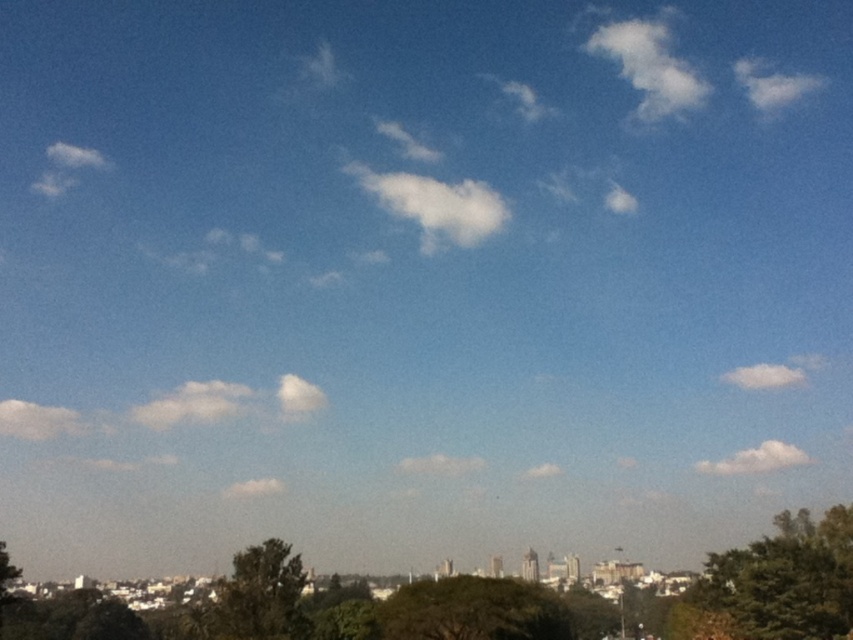
Is green leafy tree at center to the right of green leafy tree at lower center from the viewer's perspective?

Correct, you'll find green leafy tree at center to the right of green leafy tree at lower center.

Which is more to the right, green leafy tree at center or green leafy tree at lower center?

From the viewer's perspective, green leafy tree at center appears more on the right side.

Who is more distant from viewer, (521, 588) or (273, 612)?

The point (521, 588) is more distant.

Locate an element on the screen. This screenshot has height=640, width=853. green leafy tree at center is located at coordinates (473, 611).

Between green textured tree at lower right and green leafy tree at center, which one appears on the left side from the viewer's perspective?

green leafy tree at center

Between point (677, 637) and point (485, 620), which one is positioned behind?

Positioned behind is point (677, 637).

Between point (767, 593) and point (540, 612), which one is positioned behind?

Positioned behind is point (540, 612).

You are a GUI agent. You are given a task and a screenshot of the screen. Output one action in this format:
    pyautogui.click(x=<x>, y=<y>)
    Task: Click on the green textured tree at lower right
    Image resolution: width=853 pixels, height=640 pixels.
    Given the screenshot: What is the action you would take?
    pyautogui.click(x=775, y=584)

Who is positioned more to the left, green textured tree at lower right or green leafy tree at lower center?

green leafy tree at lower center

From the picture: Does green textured tree at lower right appear under green leafy tree at lower center?

Indeed, green textured tree at lower right is positioned under green leafy tree at lower center.

Find the location of a particular element. green textured tree at lower right is located at coordinates (775, 584).

This screenshot has width=853, height=640. In order to click on green textured tree at lower right in this screenshot , I will do `click(775, 584)`.